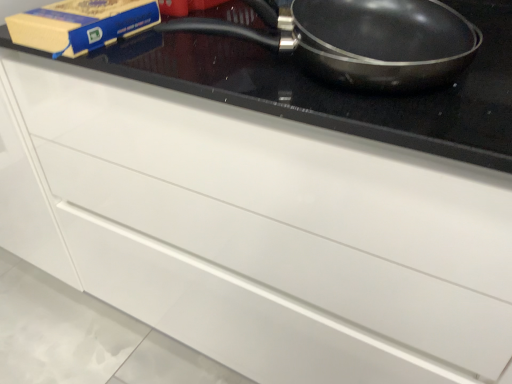
Question: Looking at the image, does matte blue paperback book at upper left seem bigger or smaller compared to black non-stick frying pan at upper right?

Choices:
 (A) small
 (B) big

Answer: (A)

Question: Is point (51, 4) positioned closer to the camera than point (455, 23)?

Choices:
 (A) farther
 (B) closer

Answer: (A)

Question: Relative to black non-stick frying pan at upper right, is matte blue paperback book at upper left in front or behind?

Choices:
 (A) front
 (B) behind

Answer: (B)

Question: In terms of size, does black non-stick frying pan at upper right appear bigger or smaller than matte blue paperback book at upper left?

Choices:
 (A) big
 (B) small

Answer: (A)

Question: Does point (333, 4) appear closer or farther from the camera than point (31, 26)?

Choices:
 (A) closer
 (B) farther

Answer: (A)

Question: Is black non-stick frying pan at upper right in front of or behind matte blue paperback book at upper left in the image?

Choices:
 (A) front
 (B) behind

Answer: (A)

Question: Is black non-stick frying pan at upper right inside or outside of matte blue paperback book at upper left?

Choices:
 (A) inside
 (B) outside

Answer: (B)